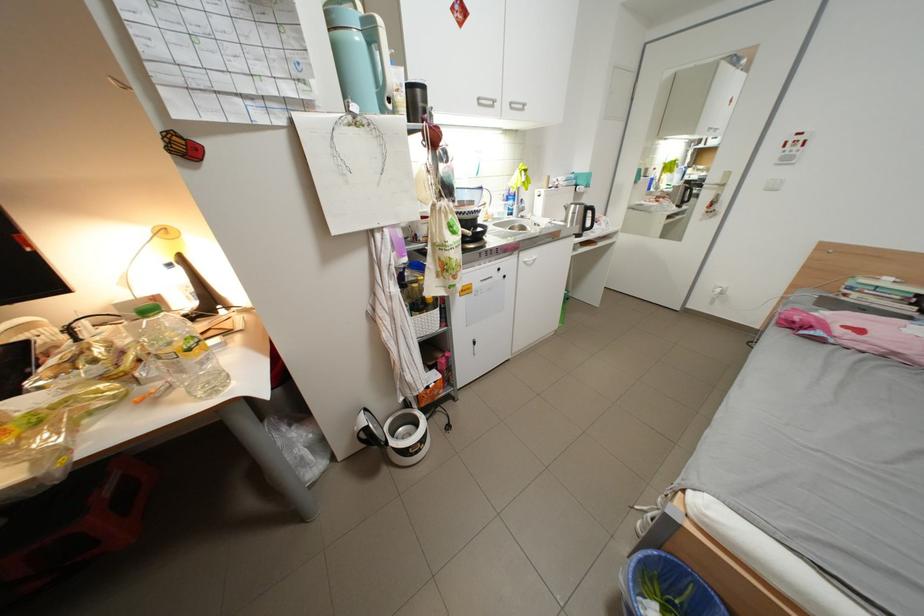
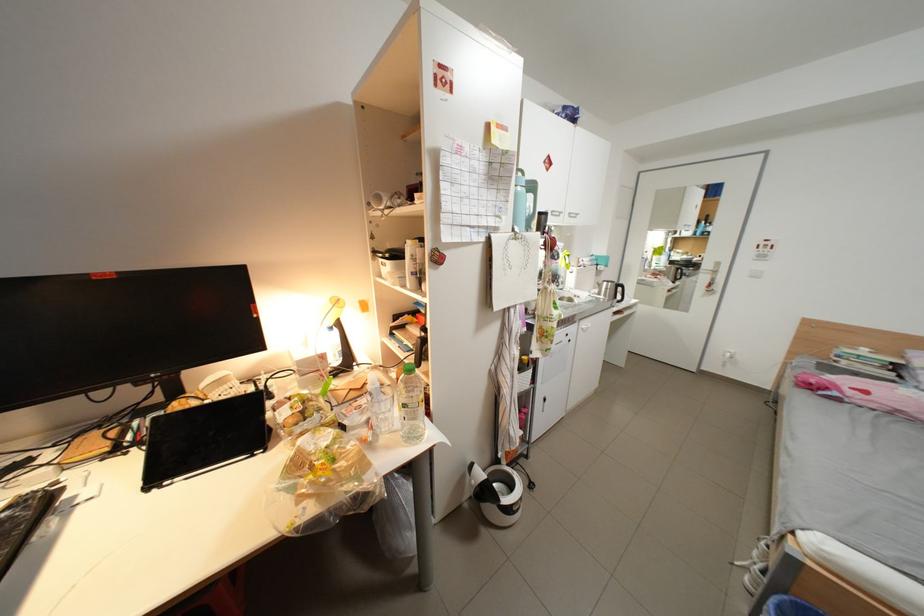
Where in the second image is the point corresponding to pixel 546 225 from the first image?

(587, 297)